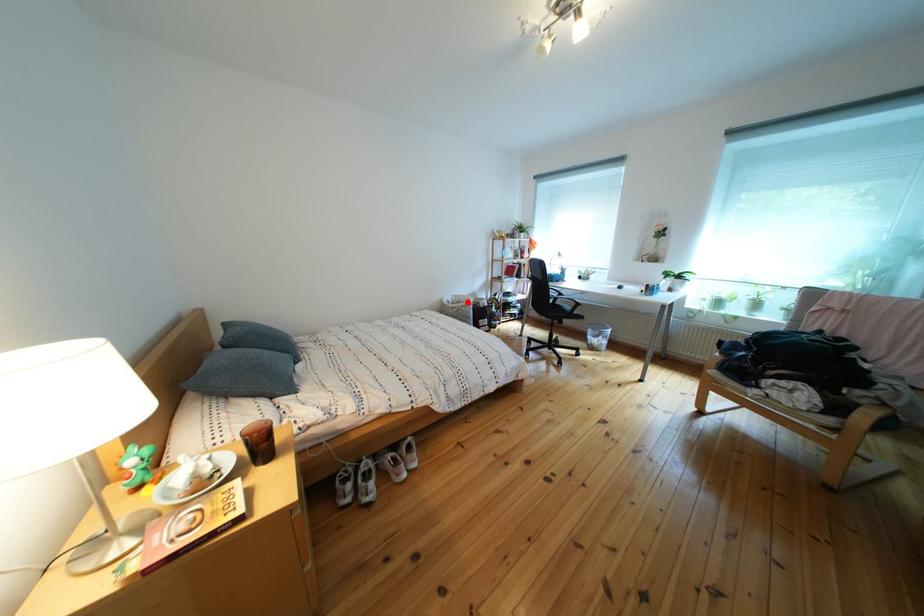
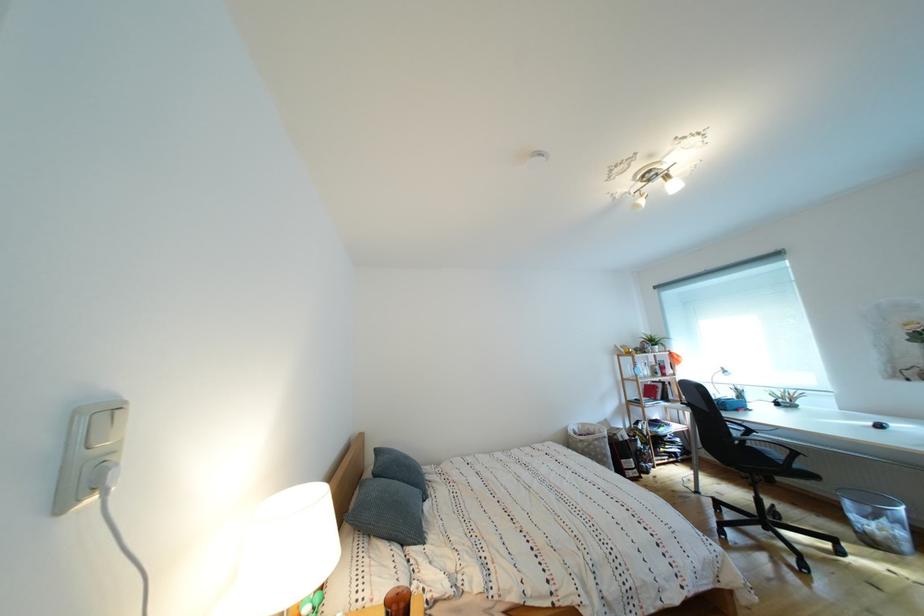
In the second image, find the point that corresponds to the highlighted location in the first image.

(594, 430)